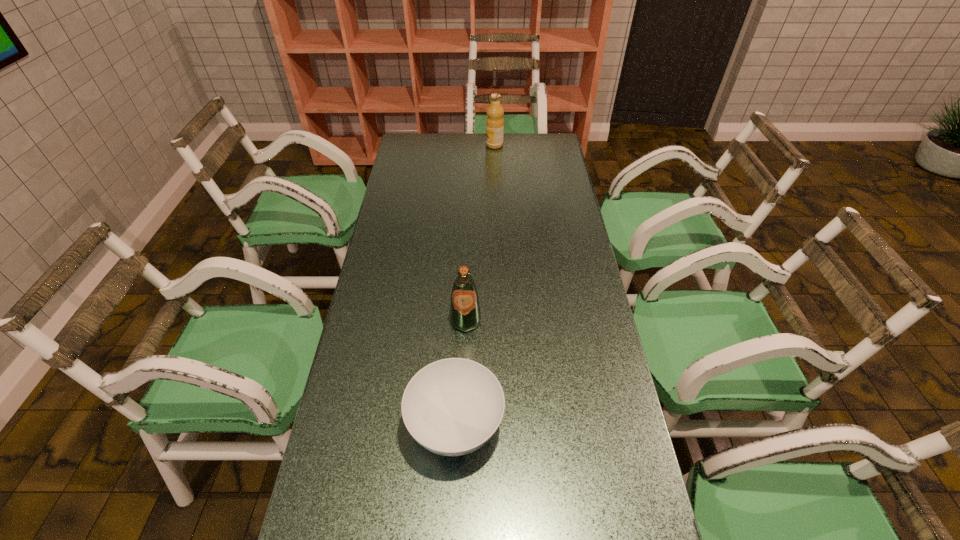
Locate an element on the screen. The image size is (960, 540). vacant space that satisfies the following two spatial constraints: 1. on the label of the right olive oil; 2. on the front-facing side of the second nearest object is located at coordinates (502, 321).

The width and height of the screenshot is (960, 540). Identify the location of free space that satisfies the following two spatial constraints: 1. on the label of the farther olive oil; 2. on the front side of the chinaware. (507, 426).

Find the location of `vacant region that satisfies the following two spatial constraints: 1. on the label of the right olive oil; 2. on the front side of the chinaware`. vacant region that satisfies the following two spatial constraints: 1. on the label of the right olive oil; 2. on the front side of the chinaware is located at coordinates (507, 426).

The height and width of the screenshot is (540, 960). Identify the location of free spot that satisfies the following two spatial constraints: 1. on the label of the right olive oil; 2. on the front-facing side of the nearer olive oil. (502, 321).

At what (x,y) coordinates should I click in order to perform the action: click on vacant region that satisfies the following two spatial constraints: 1. on the label of the right olive oil; 2. on the front side of the nearest object. Please return your answer as a coordinate pair (x, y). The width and height of the screenshot is (960, 540). Looking at the image, I should click on (507, 426).